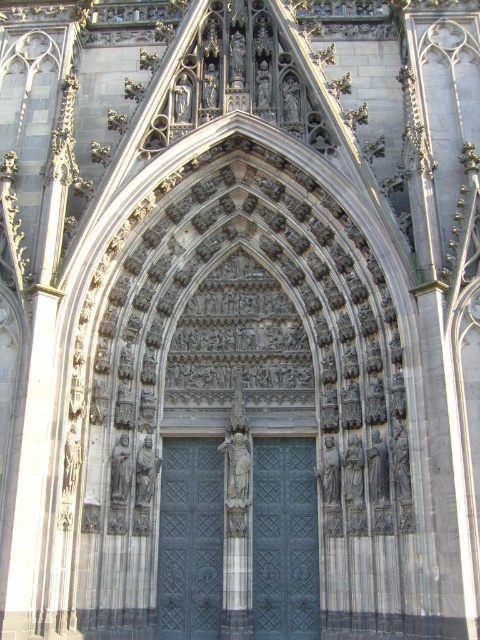
From the picture: You are standing in front of the Gothic cathedral and want to enter through the main entrance. Where exactly is the dark blue metal door at center located in terms of coordinates?

The dark blue metal door at center is located at point coordinates of (285,540).

Looking at this image, you are an architect designing a new cathedral and want to ensure that the doors are spaced appropriately for visitors to pass through comfortably. Given that the recommended minimum distance between two doors for accessibility is 14 feet, can the dark blue metal door at center and the dark gray metal door at center in the image meet this requirement?

The dark blue metal door at center is 14.53 feet from the dark gray metal door at center, which exceeds the recommended minimum distance of 14 feet. Therefore, the doors meet the accessibility requirement.